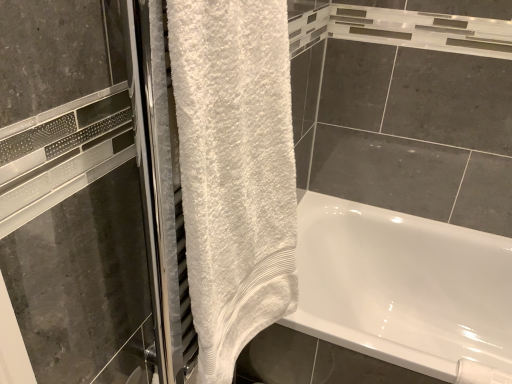
The height and width of the screenshot is (384, 512). What do you see at coordinates (234, 171) in the screenshot?
I see `white fluffy towel at left` at bounding box center [234, 171].

You are a GUI agent. You are given a task and a screenshot of the screen. Output one action in this format:
    pyautogui.click(x=<x>, y=<y>)
    Task: Click on the white fluffy towel at left
    This screenshot has width=512, height=384.
    Given the screenshot: What is the action you would take?
    pyautogui.click(x=234, y=171)

Identify the location of white glossy bathtub at lower right. (404, 289).

Describe the element at coordinates (404, 289) in the screenshot. The image size is (512, 384). I see `white glossy bathtub at lower right` at that location.

Measure the distance between white glossy bathtub at lower right and camera.

white glossy bathtub at lower right is 4.52 feet from camera.

Measure the distance between point (310, 212) and camera.

Point (310, 212) is 1.62 meters away from camera.

Locate an element on the screen. white fluffy towel at left is located at coordinates (234, 171).

Based on their positions, is white glossy bathtub at lower right located to the left or right of white fluffy towel at left?

Based on their positions, white glossy bathtub at lower right is located to the right of white fluffy towel at left.

Which object is further away from the camera taking this photo, white glossy bathtub at lower right or white fluffy towel at left?

white glossy bathtub at lower right is more distant.

Between point (407, 294) and point (210, 370), which one is positioned in front?

The point (210, 370) is closer to the camera.

From the image's perspective, which is above, white glossy bathtub at lower right or white fluffy towel at left?

From the image's view, white fluffy towel at left is above.

From a real-world perspective, is white glossy bathtub at lower right below white fluffy towel at left?

Yes, from a real-world perspective, white glossy bathtub at lower right is beneath white fluffy towel at left.

Can you confirm if white glossy bathtub at lower right is thinner than white fluffy towel at left?

No, white glossy bathtub at lower right is not thinner than white fluffy towel at left.

In terms of height, does white glossy bathtub at lower right look taller or shorter compared to white fluffy towel at left?

In the image, white glossy bathtub at lower right appears to be shorter than white fluffy towel at left.

Between white glossy bathtub at lower right and white fluffy towel at left, which one has larger size?

white glossy bathtub at lower right.

Consider the image. Can we say white glossy bathtub at lower right lies outside white fluffy towel at left?

Absolutely, white glossy bathtub at lower right is external to white fluffy towel at left.

Is white glossy bathtub at lower right in contact with white fluffy towel at left?

No, white glossy bathtub at lower right is not making contact with white fluffy towel at left.

Consider the image. Is white fluffy towel at left at the back of white glossy bathtub at lower right?

No, white glossy bathtub at lower right is not facing away from white fluffy towel at left.

Measure the distance between white glossy bathtub at lower right and white fluffy towel at left.

A distance of 32.42 inches exists between white glossy bathtub at lower right and white fluffy towel at left.

Image resolution: width=512 pixels, height=384 pixels. Identify the location of bathtub that is behind the white fluffy towel at left. (404, 289).

Is white fluffy towel at left to the right of white glossy bathtub at lower right from the viewer's perspective?

In fact, white fluffy towel at left is to the left of white glossy bathtub at lower right.

Which object is further away from the camera, white fluffy towel at left or white glossy bathtub at lower right?

white glossy bathtub at lower right.

Does point (267, 48) come farther from viewer compared to point (382, 256)?

No, (267, 48) is in front of (382, 256).

From the image's perspective, is white fluffy towel at left located above or below white glossy bathtub at lower right?

Clearly, from the image's perspective, white fluffy towel at left is above white glossy bathtub at lower right.

From a real-world perspective, relative to white glossy bathtub at lower right, is white fluffy towel at left vertically above or below?

white fluffy towel at left is above white glossy bathtub at lower right.

Which object is thinner, white fluffy towel at left or white glossy bathtub at lower right?

With smaller width is white fluffy towel at left.

Is white fluffy towel at left taller than white glossy bathtub at lower right?

Yes.

Can you confirm if white fluffy towel at left is smaller than white glossy bathtub at lower right?

Yes, white fluffy towel at left is smaller than white glossy bathtub at lower right.

Is white fluffy towel at left located outside white glossy bathtub at lower right?

Yes.

Is white fluffy towel at left far away from white glossy bathtub at lower right?

No, white fluffy towel at left is not far away from white glossy bathtub at lower right.

Could you tell me if white fluffy towel at left is turned towards white glossy bathtub at lower right?

No, white fluffy towel at left is not turned towards white glossy bathtub at lower right.

I want to click on bathtub located underneath the white fluffy towel at left (from a real-world perspective), so click(x=404, y=289).

Locate an element on the screen. The width and height of the screenshot is (512, 384). bathtub below the white fluffy towel at left (from the image's perspective) is located at coordinates (404, 289).

At what (x,y) coordinates should I click in order to perform the action: click on towel that is on the left side of white glossy bathtub at lower right. Please return your answer as a coordinate pair (x, y). Looking at the image, I should click on (234, 171).